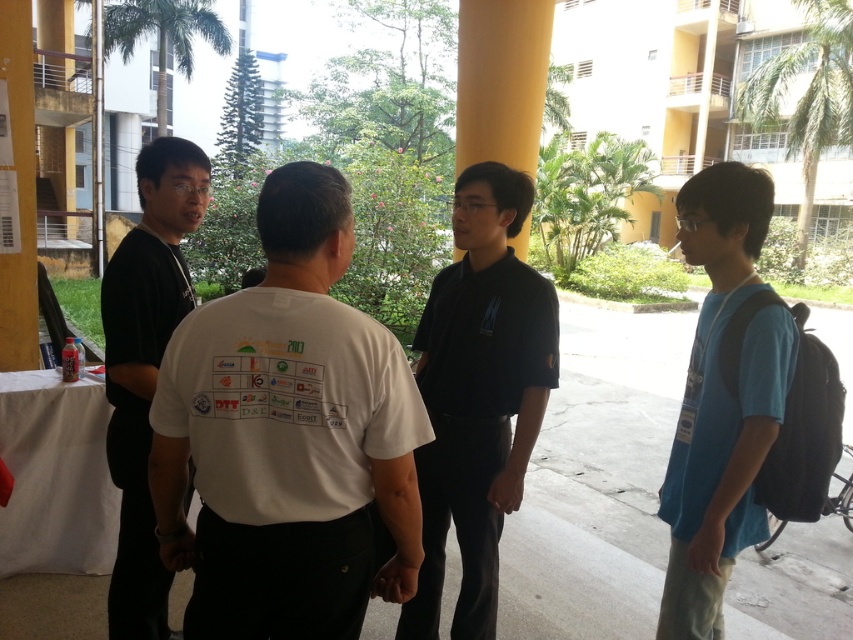
Question: Is white matte t-shirt at center to the left of blue cotton t-shirt at right from the viewer's perspective?

Choices:
 (A) no
 (B) yes

Answer: (B)

Question: Which object appears closest to the camera in this image?

Choices:
 (A) black matte shirt at left
 (B) blue cotton t-shirt at right
 (C) white matte t-shirt at center
 (D) black matte shirt at center

Answer: (C)

Question: Does white matte t-shirt at center have a smaller size compared to black matte shirt at center?

Choices:
 (A) no
 (B) yes

Answer: (B)

Question: Among these objects, which one is farthest from the camera?

Choices:
 (A) black matte shirt at left
 (B) blue cotton t-shirt at right
 (C) black matte shirt at center
 (D) white matte t-shirt at center

Answer: (C)

Question: Which object appears farthest from the camera in this image?

Choices:
 (A) blue cotton t-shirt at right
 (B) black matte shirt at left
 (C) white matte t-shirt at center

Answer: (B)

Question: Can you confirm if white matte t-shirt at center is thinner than blue cotton t-shirt at right?

Choices:
 (A) no
 (B) yes

Answer: (A)